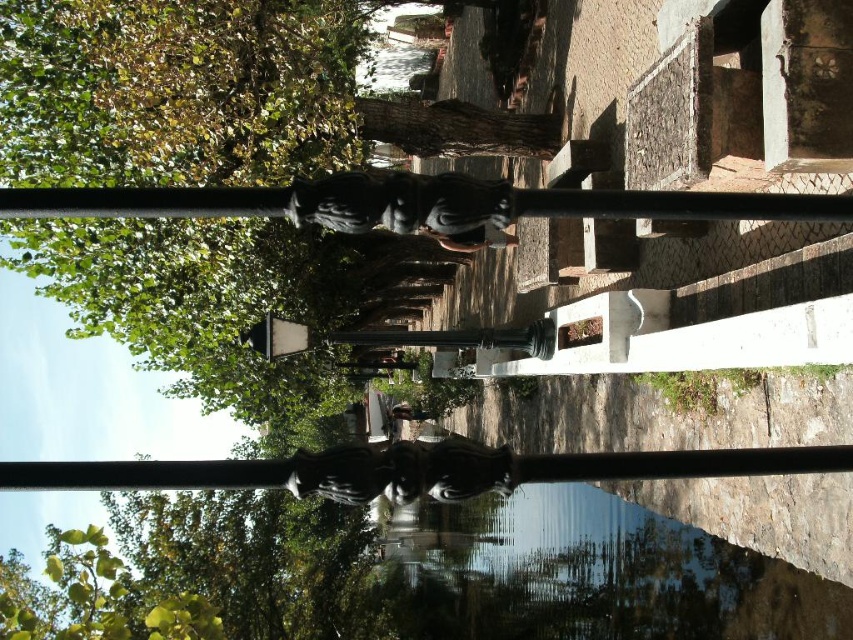
Question: Which object is positioned closest to the green leafy tree at upper left?

Choices:
 (A) glossy black statue at center
 (B) glossy reflective puddle at lower center

Answer: (A)

Question: Is green leafy tree at upper left behind glossy reflective puddle at lower center?

Choices:
 (A) no
 (B) yes

Answer: (B)

Question: Which point is closer to the camera?

Choices:
 (A) (309, 468)
 (B) (13, 260)

Answer: (A)

Question: Can you confirm if green leafy tree at upper left is positioned to the right of glossy black statue at center?

Choices:
 (A) no
 (B) yes

Answer: (A)

Question: Does green leafy tree at upper left have a smaller size compared to glossy black statue at center?

Choices:
 (A) no
 (B) yes

Answer: (A)

Question: Which point is farther to the camera?

Choices:
 (A) (x=456, y=509)
 (B) (x=102, y=134)

Answer: (A)